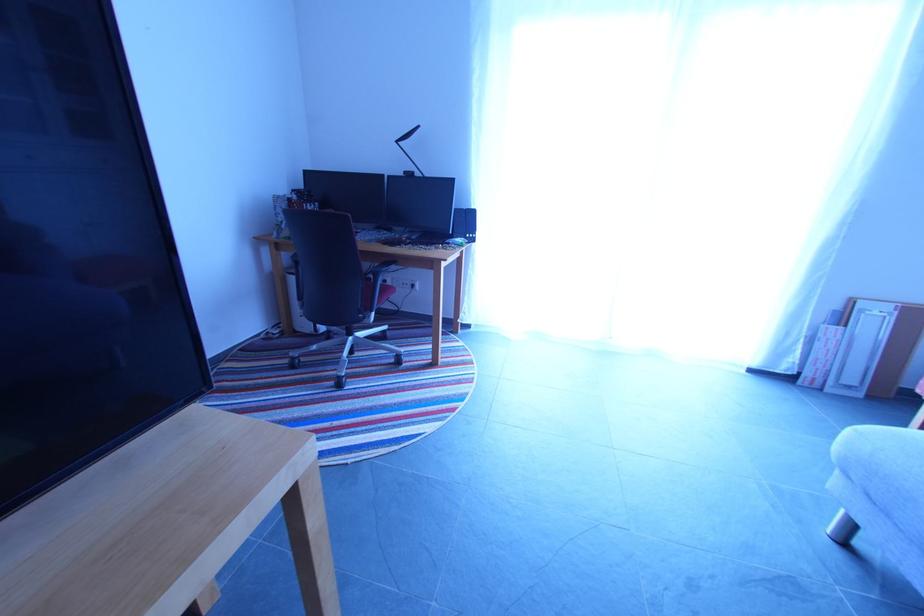
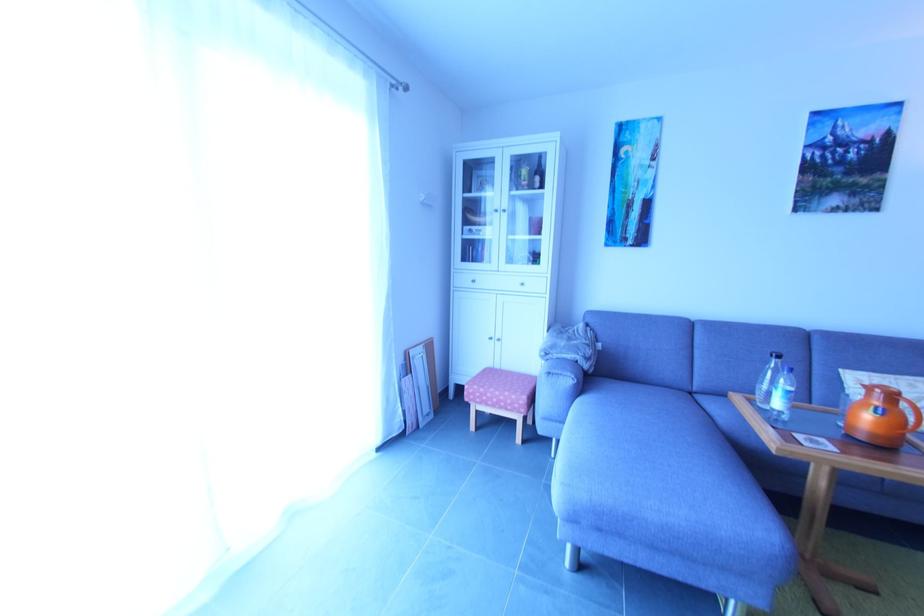
Find the pixel in the second image that matches [842,308] in the first image.

(406, 362)